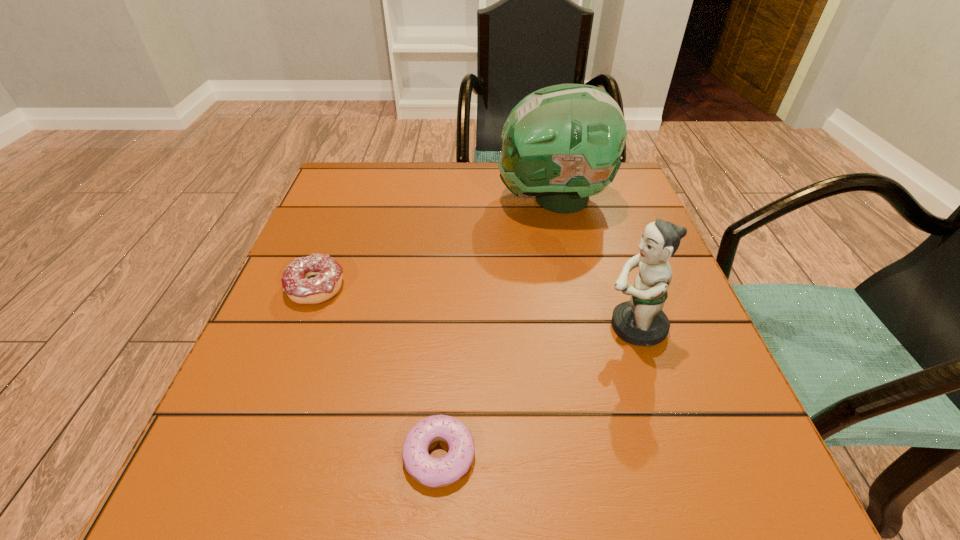
Find the location of `football helmet`. football helmet is located at coordinates (562, 143).

Locate an element on the screen. the tallest object is located at coordinates (562, 143).

At what (x,y) coordinates should I click in order to perform the action: click on the second tallest object. Please return your answer as a coordinate pair (x, y). The image size is (960, 540). Looking at the image, I should click on (640, 321).

The height and width of the screenshot is (540, 960). What are the coordinates of `the farther doughnut` in the screenshot? It's located at (327, 272).

Locate an element on the screen. This screenshot has height=540, width=960. the left doughnut is located at coordinates (327, 272).

Identify the location of the third object from right to left. This screenshot has width=960, height=540. (433, 472).

You are a GUI agent. You are given a task and a screenshot of the screen. Output one action in this format:
    pyautogui.click(x=<x>, y=<y>)
    Task: Click on the shorter doughnut
    The height and width of the screenshot is (540, 960).
    Given the screenshot: What is the action you would take?
    pyautogui.click(x=433, y=472)

What are the coordinates of `free space located 0.270m on the visor of the farthest object` in the screenshot? It's located at tap(381, 199).

At what (x,y) coordinates should I click in order to perform the action: click on vacant space situated 0.150m on the visor of the farthest object. Please return your answer as a coordinate pair (x, y). Looking at the image, I should click on (433, 199).

Locate an element on the screen. free region located 0.330m on the visor of the farthest object is located at coordinates (356, 199).